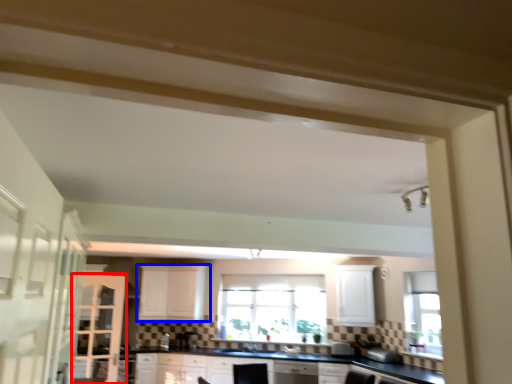
Question: Which object is closer to the camera taking this photo, screen door (highlighted by a red box) or cabinetry (highlighted by a blue box)?

Choices:
 (A) screen door
 (B) cabinetry

Answer: (A)